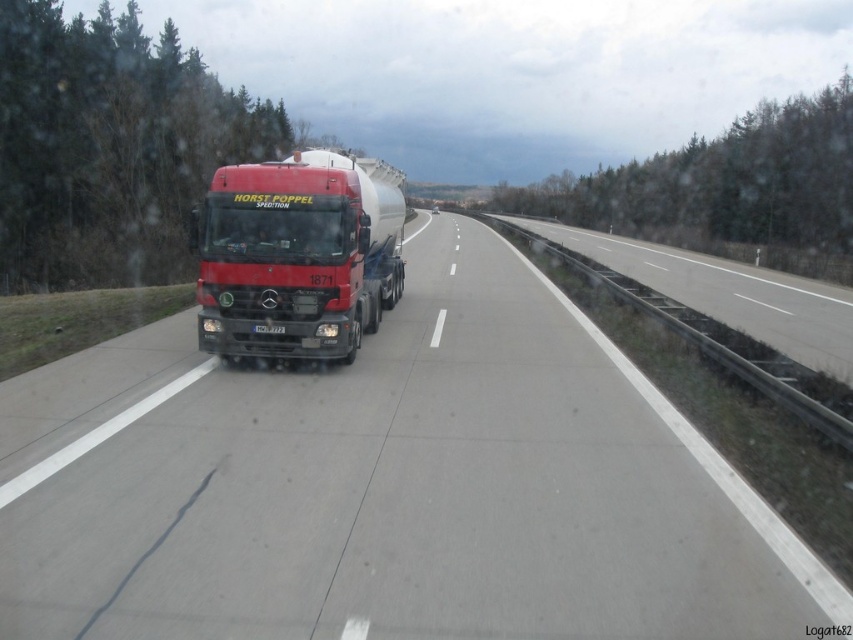
You are a driver in a car that is 1.8 meters wide. You are approaching a narrow bridge that can only accommodate vehicles up to 2.2 meters wide. You see the metallic truck at center and the metallic silver tank at center in the scene. Which one can safely pass through the narrow bridge without causing any issues?

The metallic silver tank at center can safely pass through the narrow bridge since its width is less than the truck. The metallic truck at center is wider than the tank, so it might not fit within the 2.2 meters limit. Therefore, only the metallic silver tank at center is safe to pass.

You are a driver in a car behind the metallic truck at center. You want to pass it on the highway. Is the metallic silver tank at center blocking your path directly in front of you?

The metallic truck at center is closer to the viewer than the metallic silver tank at center, so the metallic silver tank at center is behind the truck and not directly blocking your path. You can safely pass if there is an open lane.

You are a passenger in a car driving on the highway. You notice a metallic truck at center and a metallic silver tank at center. Which object is closer to you?

The metallic truck at center is closer to you because it is positioned under the metallic silver tank at center, which means the truck is in front of the tank from your perspective.